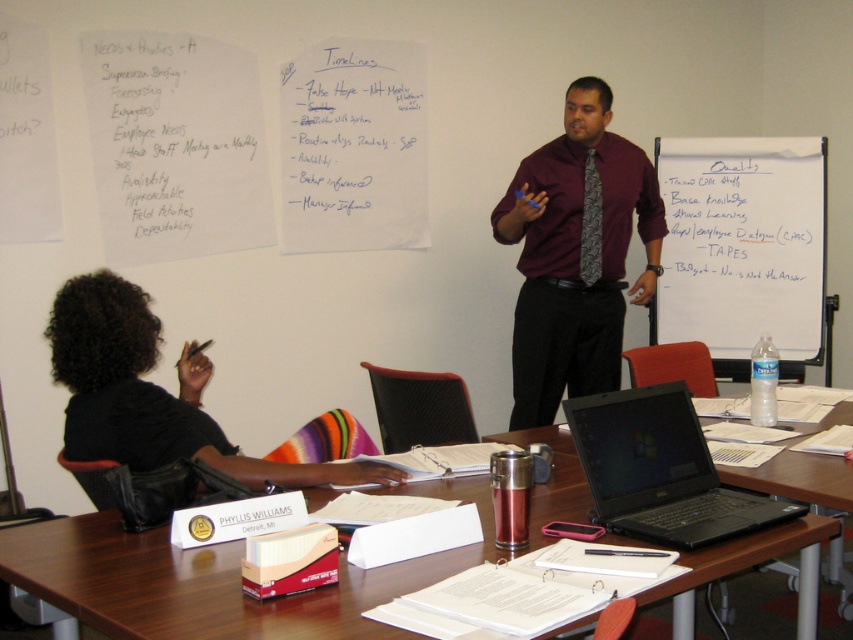
You are a participant in the meeting and want to focus on the two points marked on the wall behind the presenter. Which point is closer to you, point at position (779, 340) or the point at (621, 460)?

Point at position (621, 460) is closer to you because it is less further to the viewer than point at position (779, 340).

Where is the whiteboard at upper right located in the scene?

→ The whiteboard at upper right is located at point (746, 250) in the scene.

You are an attendee at the meeting. You need to place a notebook on the wooden table at center. Can you place it directly under the dark gray textured tie at center?

The wooden table at center is below dark gray textured tie at center, so yes, placing the notebook directly under the dark gray textured tie at center on the wooden table at center is possible.